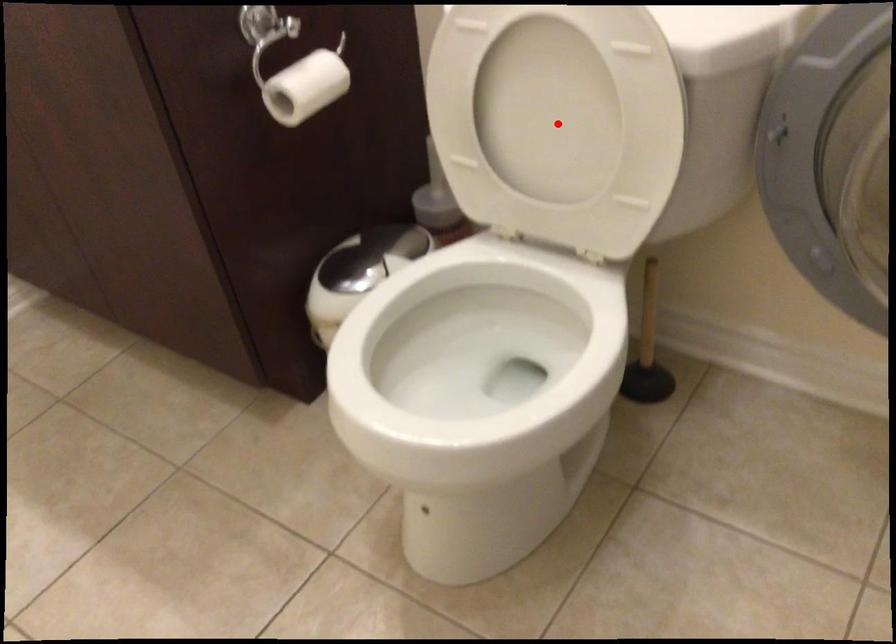
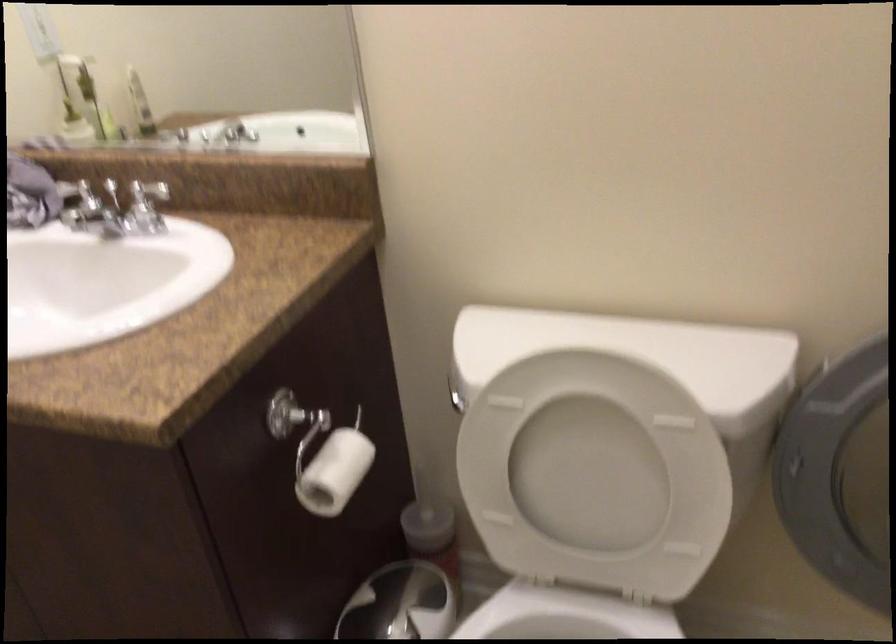
Find the pixel in the second image that matches the highlighted location in the first image.

(595, 475)